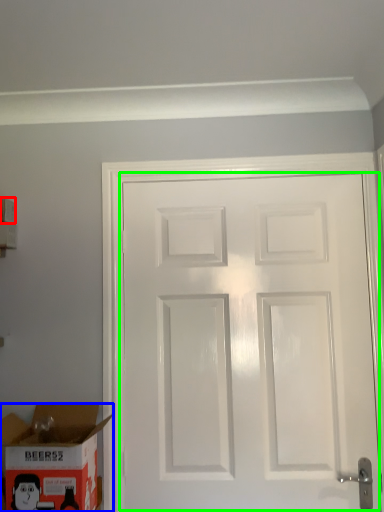
Question: Based on their relative distances, which object is nearer to box (highlighted by a red box)? Choose from box (highlighted by a blue box) and door (highlighted by a green box).

Choices:
 (A) box
 (B) door

Answer: (A)